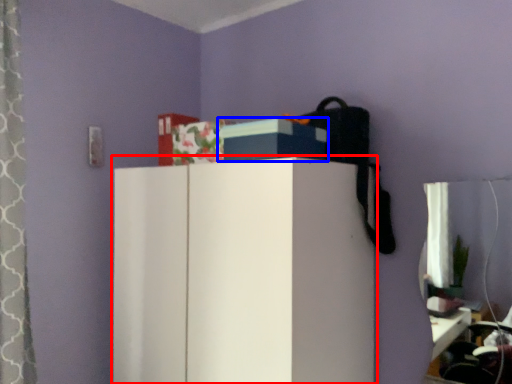
Question: Which of the following is the farthest to the observer, furniture (highlighted by a red box) or storage box (highlighted by a blue box)?

Choices:
 (A) furniture
 (B) storage box

Answer: (B)